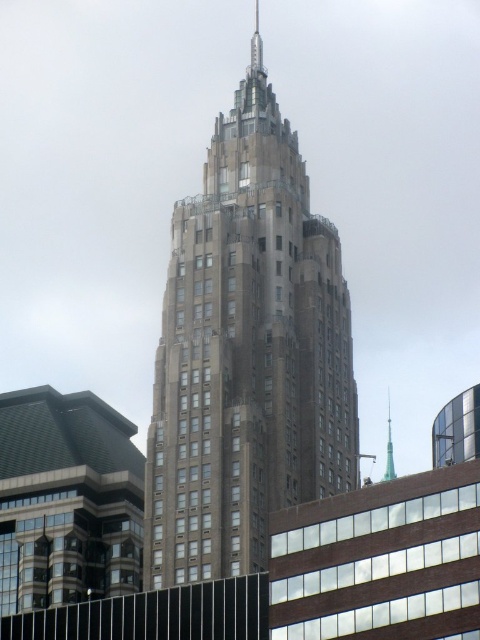
Question: Which of the following is the farthest from the observer?

Choices:
 (A) brown stone tower at center
 (B) green glass spire at upper center

Answer: (B)

Question: Which point is closer to the camera?

Choices:
 (A) (261, 84)
 (B) (393, 460)

Answer: (A)

Question: Which point is closer to the camera?

Choices:
 (A) green glass spire at upper center
 (B) brown stone tower at center

Answer: (B)

Question: Is brown stone tower at center smaller than green glass spire at upper center?

Choices:
 (A) yes
 (B) no

Answer: (B)

Question: Does brown stone tower at center have a greater width compared to green glass spire at upper center?

Choices:
 (A) no
 (B) yes

Answer: (B)

Question: Is brown stone tower at center smaller than green glass spire at upper center?

Choices:
 (A) yes
 (B) no

Answer: (B)